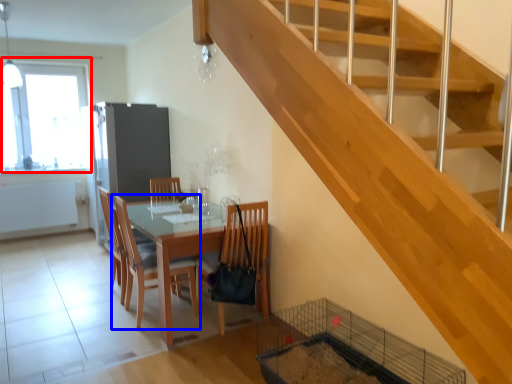
Question: Which point is further to the camera, window (highlighted by a red box) or chair (highlighted by a blue box)?

Choices:
 (A) window
 (B) chair

Answer: (A)